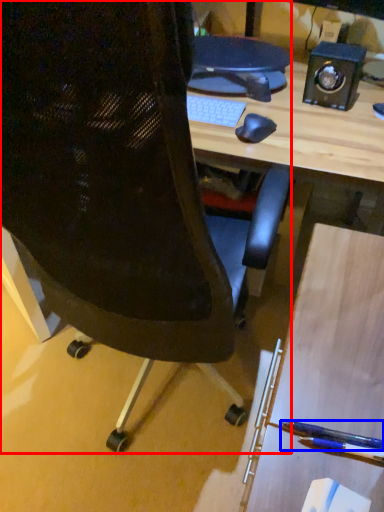
Question: Which of the following is the farthest to the observer, chair (highlighted by a red box) or penguin (highlighted by a blue box)?

Choices:
 (A) chair
 (B) penguin

Answer: (B)